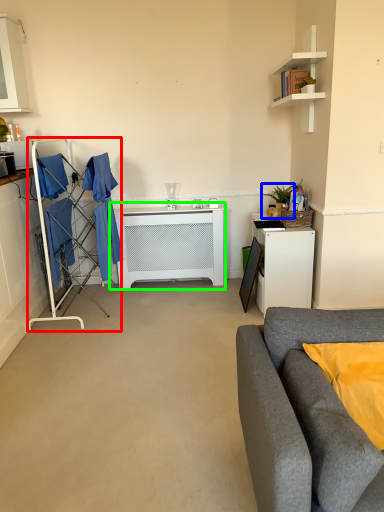
Question: Which object is the farthest from closet (highlighted by a red box)? Choose among these: houseplant (highlighted by a blue box) or table (highlighted by a green box).

Choices:
 (A) houseplant
 (B) table

Answer: (A)